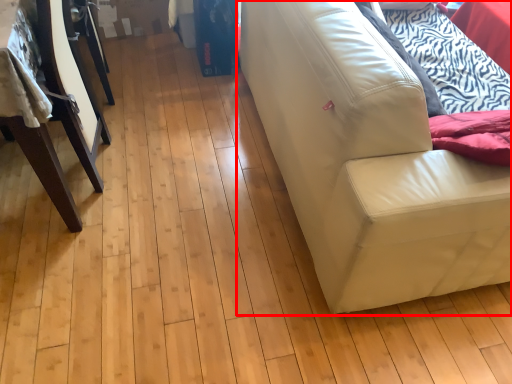
Question: From the image's perspective, considering the relative positions of studio couch (annotated by the red box) and furniture in the image provided, where is studio couch (annotated by the red box) located with respect to the staircase?

Choices:
 (A) below
 (B) above

Answer: (A)